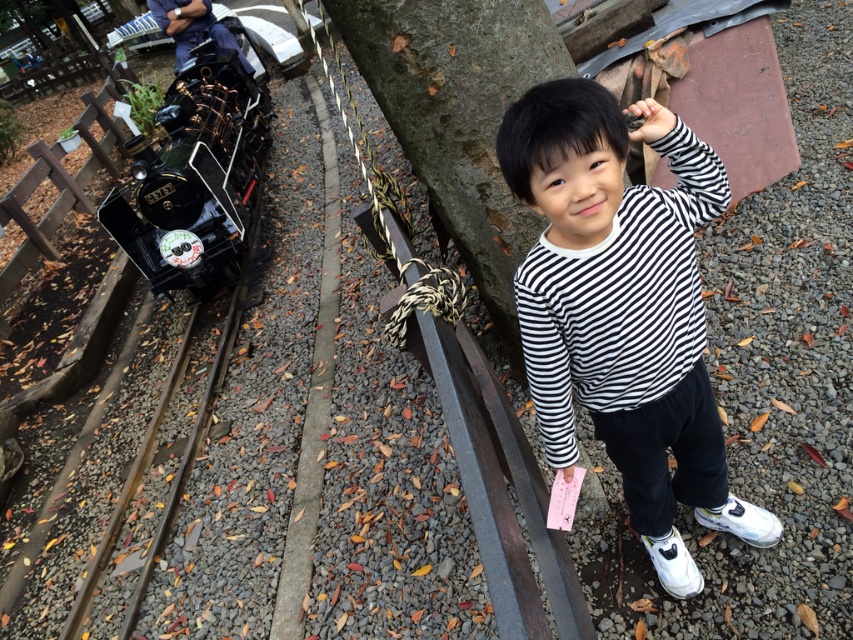
Question: Based on their relative distances, which object is nearer to the black striped shirt at center?

Choices:
 (A) brown wooden train track at left
 (B) shiny black locomotive at left

Answer: (A)

Question: Which object appears closest to the camera in this image?

Choices:
 (A) brown wooden train track at left
 (B) shiny black locomotive at left
 (C) black striped shirt at center

Answer: (C)

Question: Is black striped shirt at center to the left of shiny black locomotive at left from the viewer's perspective?

Choices:
 (A) yes
 (B) no

Answer: (B)

Question: Does black striped shirt at center have a lesser width compared to brown wooden train track at left?

Choices:
 (A) no
 (B) yes

Answer: (A)

Question: From the image, what is the correct spatial relationship of black striped shirt at center in relation to shiny black locomotive at left?

Choices:
 (A) above
 (B) below

Answer: (B)

Question: Which point appears closest to the camera in this image?

Choices:
 (A) (596, 387)
 (B) (236, 314)

Answer: (A)